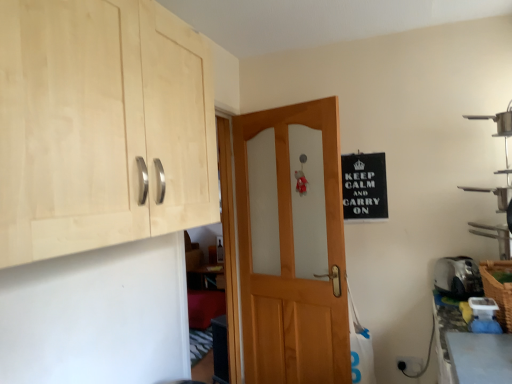
Question: In the image, is metallic silver shelf at right positioned in front of or behind black paper sign at upper right?

Choices:
 (A) front
 (B) behind

Answer: (A)

Question: Choose the correct answer: Is metallic silver shelf at right inside black paper sign at upper right or outside it?

Choices:
 (A) outside
 (B) inside

Answer: (A)

Question: Which is nearer to the wooden door at center?

Choices:
 (A) metallic silver shelf at right
 (B) woven brown basket at lower right
 (C) black plastic electric outlet at lower right
 (D) black paper sign at upper right
 (E) natural wood cabinet at upper left

Answer: (D)

Question: Based on their relative distances, which object is farther from the silver metallic toaster at lower right?

Choices:
 (A) woven brown basket at lower right
 (B) black paper sign at upper right
 (C) black plastic electric outlet at lower right
 (D) metallic silver shelf at right
 (E) natural wood cabinet at upper left

Answer: (E)